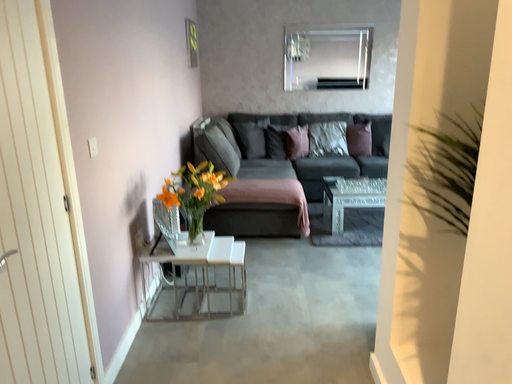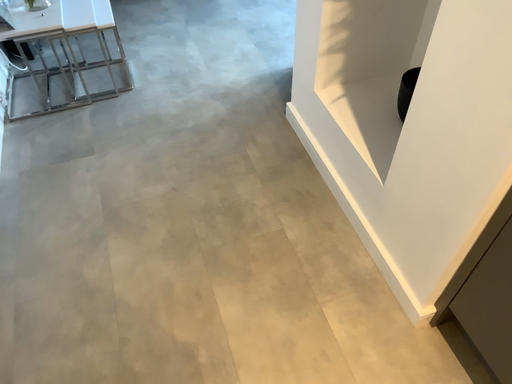
Question: How did the camera likely rotate when shooting the video?

Choices:
 (A) rotated downward
 (B) rotated upward

Answer: (A)